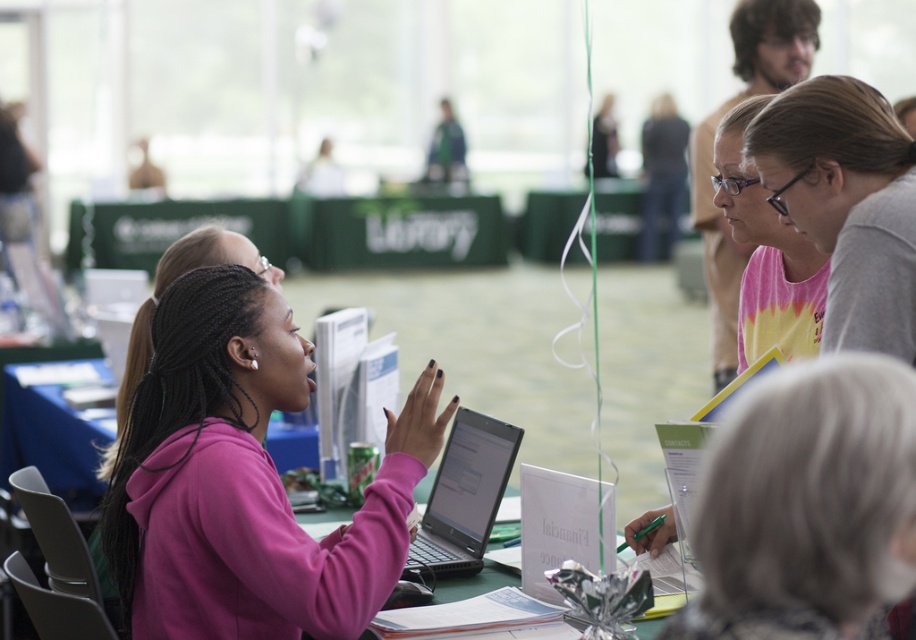
From the picture: You are a person with a 5.5 feet long extension cord that you need to place between the gray fabric at center and the black glossy laptop at center. Can you fit the extension cord between them?

The distance between the gray fabric at center and the black glossy laptop at center is 5.18 feet. Since the extension cord is 5.5 feet long, it is slightly longer than the space available. Therefore, the extension cord cannot be fully placed between them without overlapping or bending.